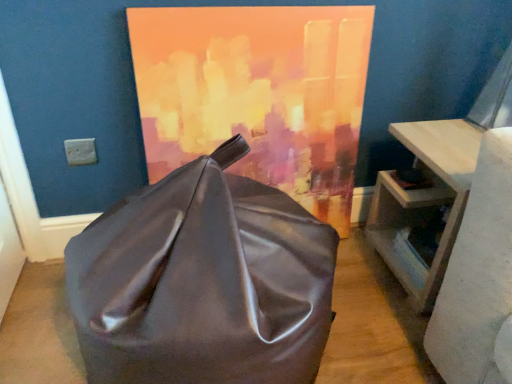
Question: Is shiny brown bean bag at center shorter than light wood table at right?

Choices:
 (A) yes
 (B) no

Answer: (B)

Question: Are shiny brown bean bag at center and light wood table at right making contact?

Choices:
 (A) yes
 (B) no

Answer: (B)

Question: Does shiny brown bean bag at center appear on the right side of light wood table at right?

Choices:
 (A) no
 (B) yes

Answer: (A)

Question: Does shiny brown bean bag at center have a larger size compared to light wood table at right?

Choices:
 (A) yes
 (B) no

Answer: (A)

Question: Is light wood table at right a part of shiny brown bean bag at center?

Choices:
 (A) yes
 (B) no

Answer: (B)

Question: Considering the relative positions of shiny brown bean bag at center and light wood table at right in the image provided, is shiny brown bean bag at center behind light wood table at right?

Choices:
 (A) yes
 (B) no

Answer: (B)

Question: Does matte acrylic painting at center contain light wood table at right?

Choices:
 (A) no
 (B) yes

Answer: (A)

Question: Does matte acrylic painting at center have a greater width compared to light wood table at right?

Choices:
 (A) no
 (B) yes

Answer: (A)

Question: Is the position of matte acrylic painting at center less distant than that of light wood table at right?

Choices:
 (A) no
 (B) yes

Answer: (B)

Question: Would you consider matte acrylic painting at center to be distant from light wood table at right?

Choices:
 (A) yes
 (B) no

Answer: (B)

Question: Considering the relative sizes of matte acrylic painting at center and light wood table at right in the image provided, is matte acrylic painting at center bigger than light wood table at right?

Choices:
 (A) no
 (B) yes

Answer: (A)

Question: Is matte acrylic painting at center not inside light wood table at right?

Choices:
 (A) no
 (B) yes

Answer: (B)

Question: Is light wood table at right facing towards shiny brown bean bag at center?

Choices:
 (A) yes
 (B) no

Answer: (A)